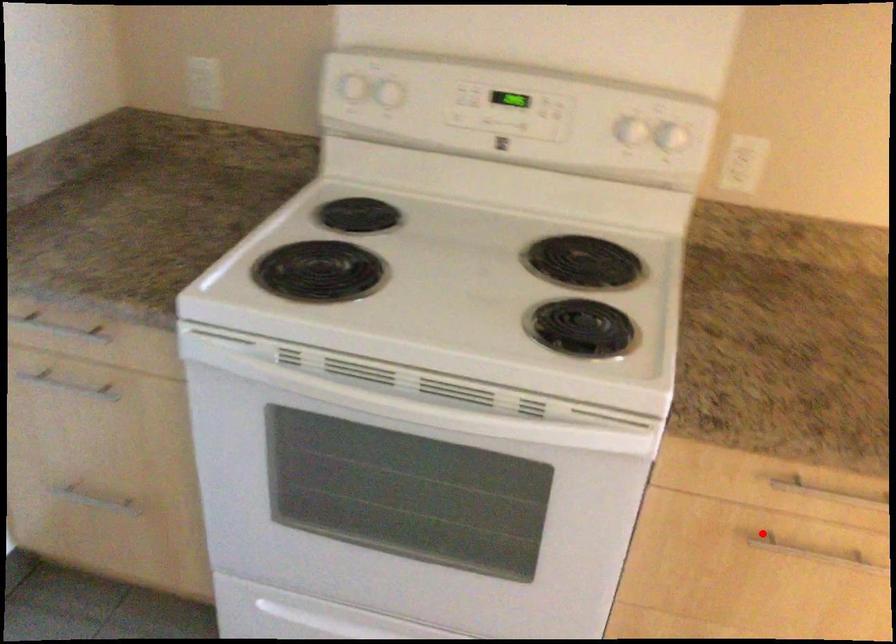
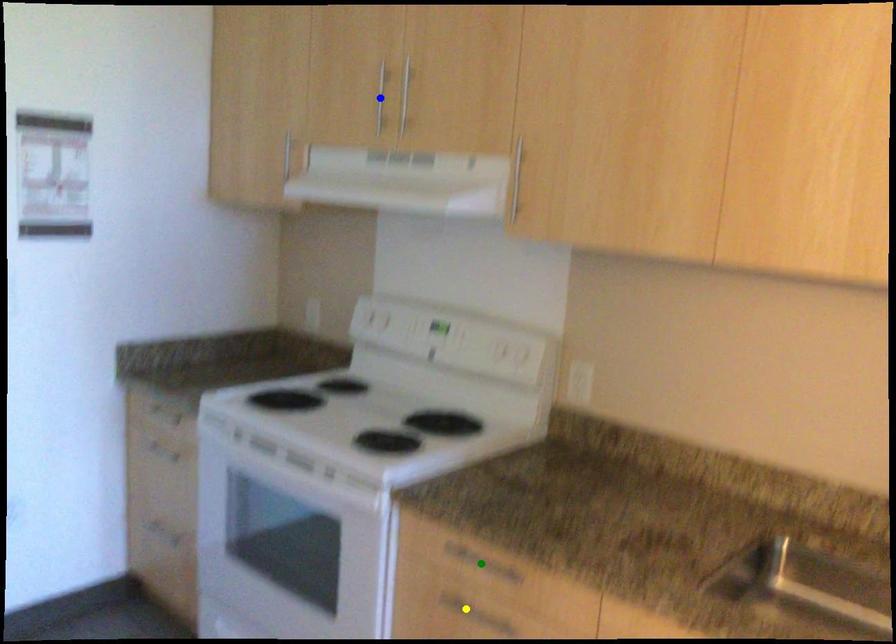
Question: I am providing you with two images of the same scene from different viewpoints. A red point is marked on the first image. You are given multiple points on the second image. Which point in image 2 represents the same 3d spot as the red point in image 1?

Choices:
 (A) green point
 (B) yellow point
 (C) blue point

Answer: (B)